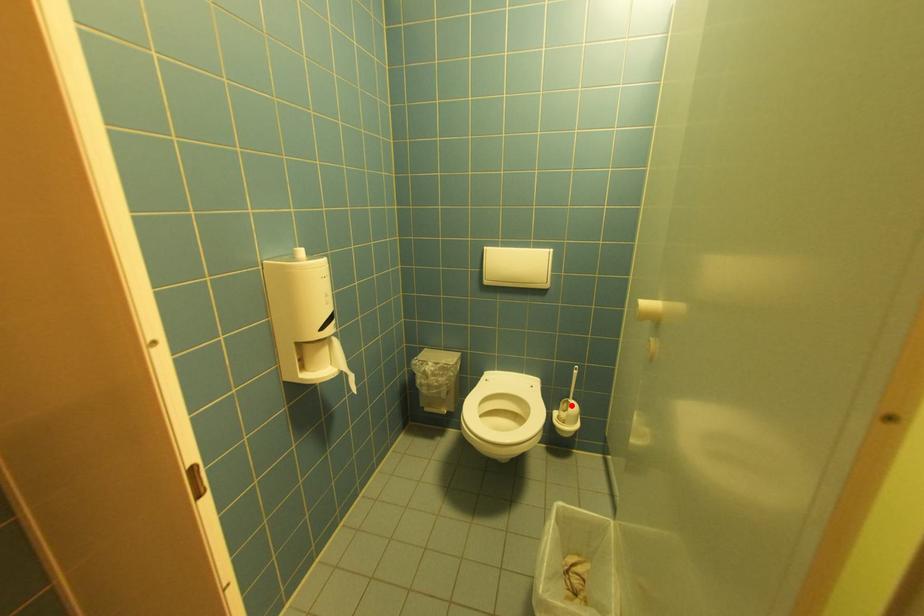
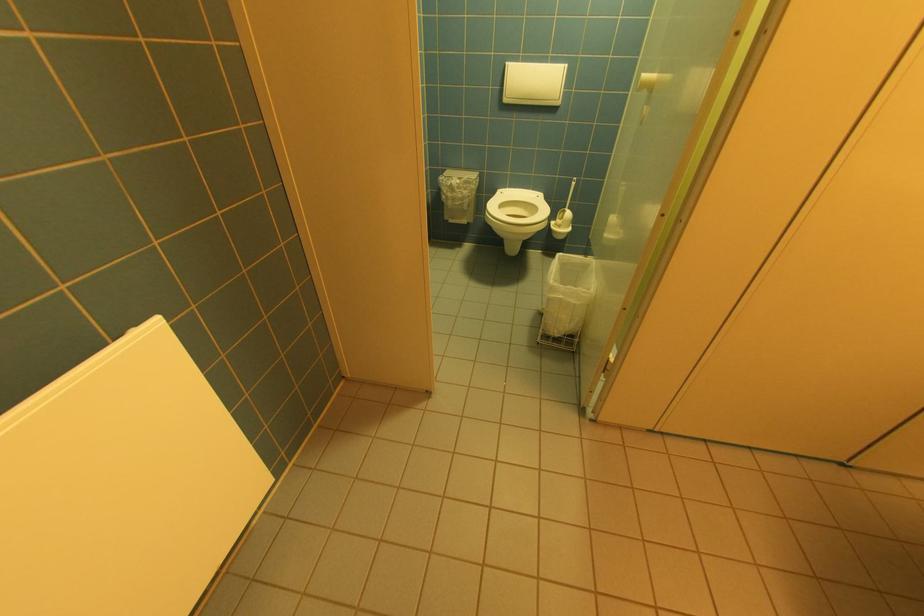
Locate, in the second image, the point that corresponds to the highlighted location in the first image.

(567, 215)